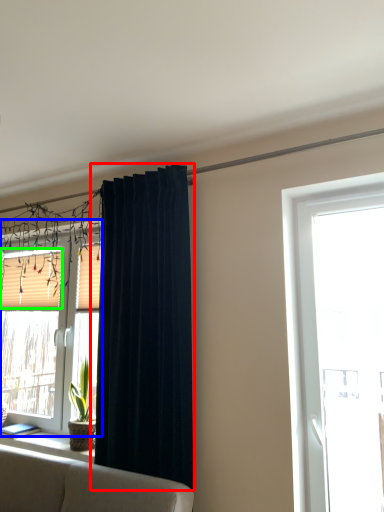
Question: Which object is positioned farthest from curtain (highlighted by a red box)? Select from window (highlighted by a blue box) and shutter (highlighted by a green box).

Choices:
 (A) window
 (B) shutter

Answer: (A)